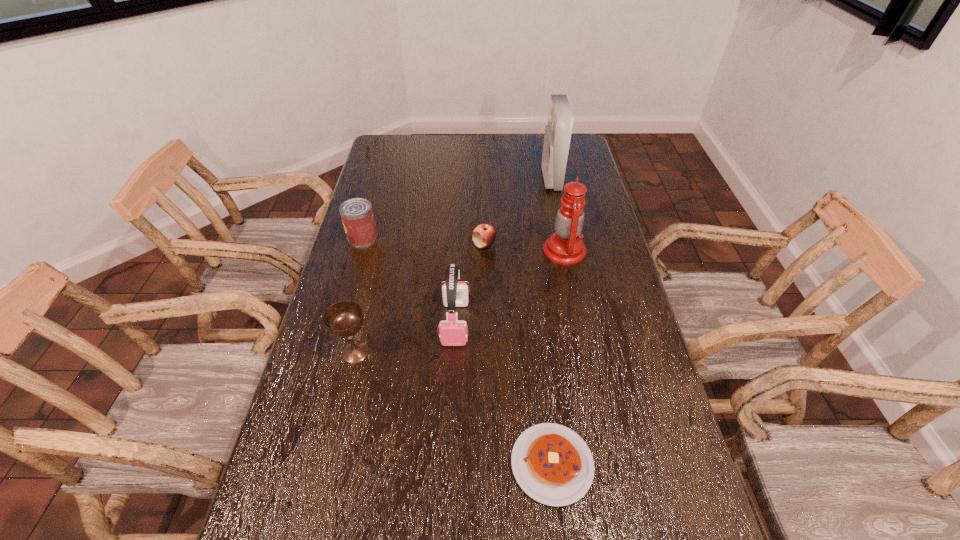
The width and height of the screenshot is (960, 540). I want to click on blank region between the shortest object and the chalice, so click(454, 408).

The height and width of the screenshot is (540, 960). Find the location of `free point between the can and the first-aid kit`. free point between the can and the first-aid kit is located at coordinates (457, 208).

You are a GUI agent. You are given a task and a screenshot of the screen. Output one action in this format:
    pyautogui.click(x=<x>, y=<y>)
    Task: Click on the unoccupied area between the oil lamp and the earphone
    The width and height of the screenshot is (960, 540).
    Given the screenshot: What is the action you would take?
    pyautogui.click(x=510, y=287)

Where is `empty space that is in between the earphone and the farthest object`? empty space that is in between the earphone and the farthest object is located at coordinates (503, 251).

Image resolution: width=960 pixels, height=540 pixels. I want to click on vacant region between the fourth tallest object and the sixth tallest object, so click(420, 299).

Find the location of a particular element. The height and width of the screenshot is (540, 960). empty location between the earphone and the fifth tallest object is located at coordinates (409, 280).

The image size is (960, 540). In order to click on object that can be found as the fourth closest to the pancake in this screenshot , I will do `click(484, 235)`.

Identify which object is the closest to the oil lamp. Please provide its 2D coordinates. Your answer should be formatted as a tuple, i.e. [(x, y)], where the tuple contains the x and y coordinates of a point satisfying the conditions above.

[(484, 235)]

Image resolution: width=960 pixels, height=540 pixels. What are the coordinates of `vacant space that satisfies the following two spatial constraints: 1. on the front-facing side of the first-aid kit; 2. on the outer surface of the earphone` in the screenshot? It's located at (580, 323).

Where is `free location that satisfies the following two spatial constraints: 1. on the front-facing side of the farthest object; 2. on the front side of the chalice`? The width and height of the screenshot is (960, 540). free location that satisfies the following two spatial constraints: 1. on the front-facing side of the farthest object; 2. on the front side of the chalice is located at coordinates (586, 352).